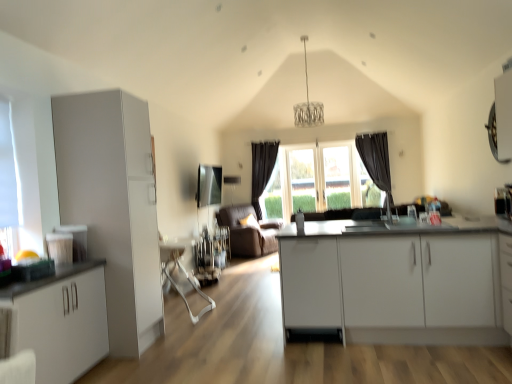
Question: In terms of size, does transparent glass door at center appear bigger or smaller than dark grey fabric curtain at right, the second curtain in the back-to-front sequence?

Choices:
 (A) big
 (B) small

Answer: (B)

Question: Considering the positions of point click(x=308, y=177) and point click(x=356, y=150), is point click(x=308, y=177) closer or farther from the camera than point click(x=356, y=150)?

Choices:
 (A) closer
 (B) farther

Answer: (B)

Question: Estimate the real-world distances between objects in this image. Which object is closer to the transparent glass window at center, which is counted as the 2th window, starting from the left?

Choices:
 (A) white plastic swivel chair at center
 (B) brown leather couch at center
 (C) white matte cabinet at center, the first cabinetry in the right-to-left sequence
 (D) clear glass window at center, the 1th window viewed from the back
 (E) white matte cabinet at left, the second cabinetry in the right-to-left sequence

Answer: (D)

Question: Considering the real-world distances, which object is farthest from the brown leather couch at center?

Choices:
 (A) white matte cabinet at left, marked as the 2th cabinetry in a left-to-right arrangement
 (B) clear glass window at center, the 1th window viewed from the right
 (C) white plastic swivel chair at center
 (D) white matte cabinet at center, the first cabinetry in the right-to-left sequence
 (E) dark fabric curtain at center, acting as the 2th curtain starting from the right

Answer: (D)